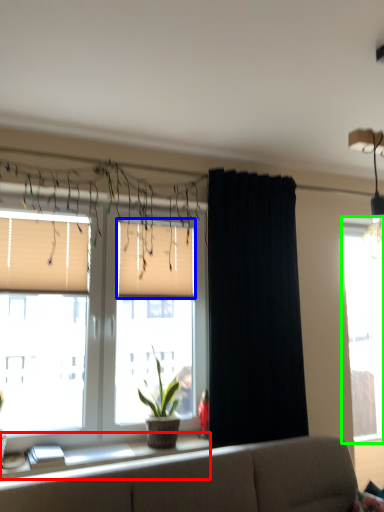
Question: Which is nearer to the window sill (highlighted by a red box)? window blind (highlighted by a blue box) or window (highlighted by a green box).

Choices:
 (A) window blind
 (B) window

Answer: (A)